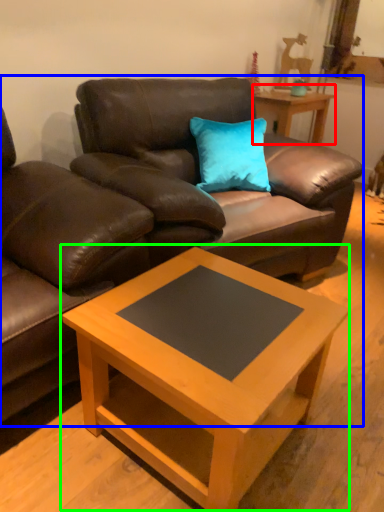
Question: Which object is the closest to the table (highlighted by a red box)? Choose among these: studio couch (highlighted by a blue box) or coffee table (highlighted by a green box).

Choices:
 (A) studio couch
 (B) coffee table

Answer: (A)